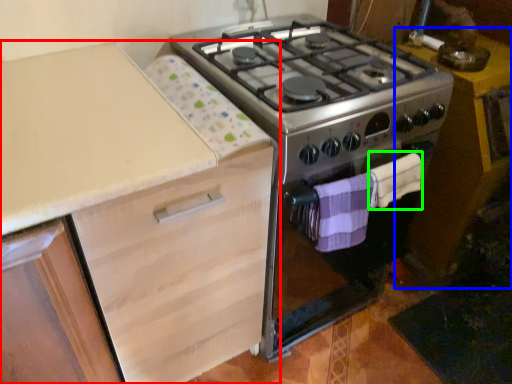
Question: Which object is the farthest from cabinetry (highlighted by a red box)? Choose among these: table (highlighted by a blue box) or blanket (highlighted by a green box).

Choices:
 (A) table
 (B) blanket

Answer: (A)